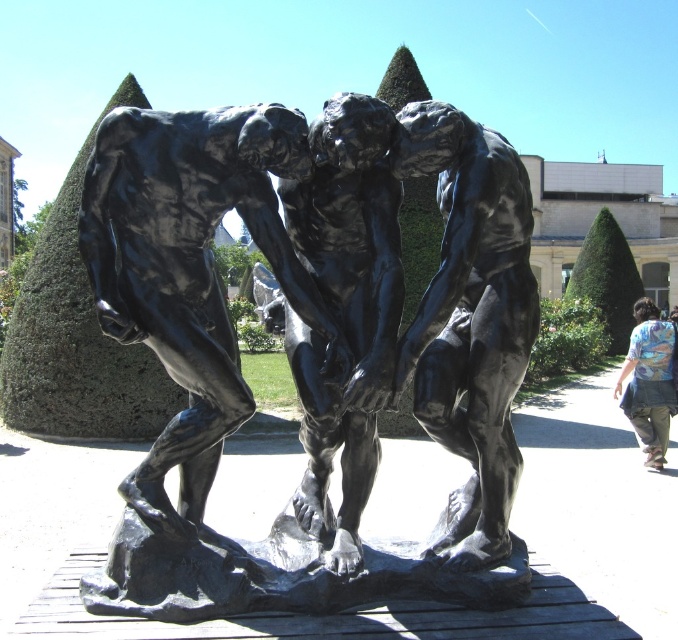
Question: Can you confirm if black polished bronze sculpture at center is thinner than floral shirt at lower right?

Choices:
 (A) yes
 (B) no

Answer: (B)

Question: Which object is the farthest from the black polished bronze sculpture at center?

Choices:
 (A) polished black statue at center
 (B) floral shirt at lower right
 (C) black polished stone sculpture at center
 (D) black polished statue at center

Answer: (B)

Question: Which is nearer to the black polished statue at center?

Choices:
 (A) floral shirt at lower right
 (B) polished black statue at center
 (C) black polished stone sculpture at center
 (D) black polished bronze sculpture at center

Answer: (D)

Question: Does black polished stone sculpture at center appear under polished black statue at center?

Choices:
 (A) no
 (B) yes

Answer: (A)

Question: Estimate the real-world distances between objects in this image. Which object is farther from the black polished statue at center?

Choices:
 (A) black polished bronze sculpture at center
 (B) floral shirt at lower right

Answer: (B)

Question: Where is black polished stone sculpture at center located in relation to black polished statue at center in the image?

Choices:
 (A) right
 (B) left

Answer: (B)